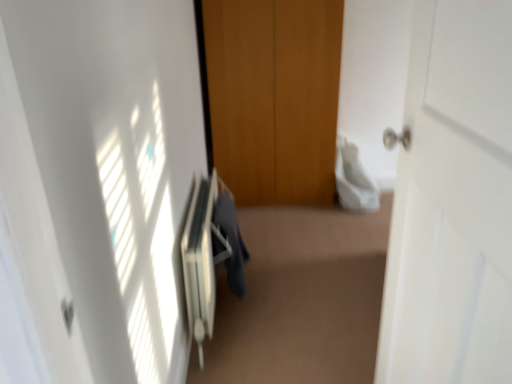
Question: From a real-world perspective, is white plastic radiator at center physically below dark gray fabric at center?

Choices:
 (A) no
 (B) yes

Answer: (B)

Question: Can you confirm if white plastic radiator at center is bigger than dark gray fabric at center?

Choices:
 (A) no
 (B) yes

Answer: (B)

Question: Is white plastic radiator at center taller than dark gray fabric at center?

Choices:
 (A) no
 (B) yes

Answer: (B)

Question: Does white plastic radiator at center come behind dark gray fabric at center?

Choices:
 (A) yes
 (B) no

Answer: (B)

Question: Does white plastic radiator at center have a lesser width compared to dark gray fabric at center?

Choices:
 (A) yes
 (B) no

Answer: (B)

Question: From the image's perspective, does white plastic radiator at center appear higher than dark gray fabric at center?

Choices:
 (A) yes
 (B) no

Answer: (B)

Question: Can we say dark gray fabric at center lies outside white plastic radiator at center?

Choices:
 (A) yes
 (B) no

Answer: (B)

Question: Can you confirm if dark gray fabric at center is positioned to the left of white plastic radiator at center?

Choices:
 (A) yes
 (B) no

Answer: (B)

Question: From a real-world perspective, is dark gray fabric at center positioned under white plastic radiator at center based on gravity?

Choices:
 (A) yes
 (B) no

Answer: (B)

Question: Does dark gray fabric at center have a greater width compared to white plastic radiator at center?

Choices:
 (A) no
 (B) yes

Answer: (A)

Question: Is dark gray fabric at center behind white plastic radiator at center?

Choices:
 (A) no
 (B) yes

Answer: (B)

Question: From the image's perspective, is dark gray fabric at center on white plastic radiator at center?

Choices:
 (A) no
 (B) yes

Answer: (B)

Question: From the image's perspective, is dark gray fabric at center under white matte door at right?

Choices:
 (A) no
 (B) yes

Answer: (B)